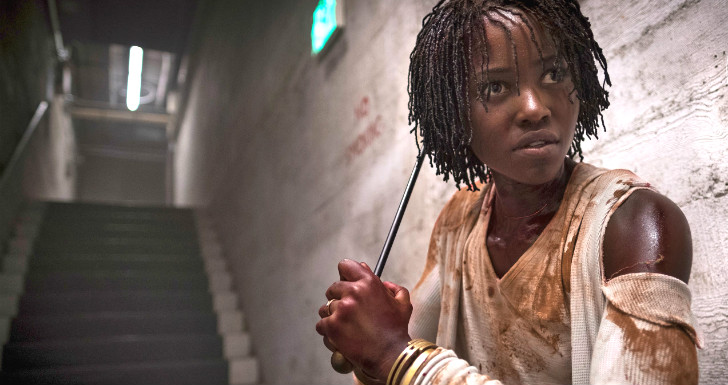
You are a GUI agent. You are given a task and a screenshot of the screen. Output one action in this format:
    pyautogui.click(x=<x>, y=<y>)
    Task: Click on the wall
    
    Given the screenshot: What is the action you would take?
    pyautogui.click(x=678, y=118), pyautogui.click(x=17, y=103)